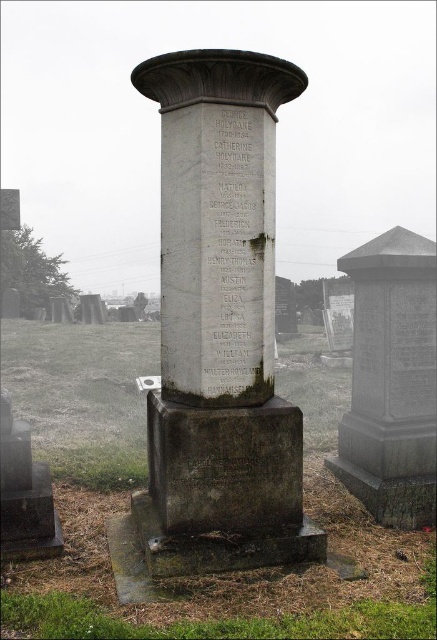
Between granite stone monument at center and white marble stone at center, which one is positioned higher?

Positioned higher is white marble stone at center.

Between granite stone monument at center and white marble stone at center, which one is positioned lower?

granite stone monument at center is lower down.

Between point (381, 285) and point (217, 365), which one is positioned in front?

Point (217, 365) is more forward.

At what (x,y) coordinates should I click in order to perform the action: click on granite stone monument at center. Please return your answer as a coordinate pair (x, y). Looking at the image, I should click on point(391,380).

Does granite stone column at center appear on the right side of black stone inscription at lower center?

No, granite stone column at center is not to the right of black stone inscription at lower center.

Between point (212, 244) and point (228, 449), which one is positioned behind?

Point (212, 244)

The image size is (437, 640). What do you see at coordinates (218, 310) in the screenshot?
I see `granite stone column at center` at bounding box center [218, 310].

You are a GUI agent. You are given a task and a screenshot of the screen. Output one action in this format:
    pyautogui.click(x=<x>, y=<y>)
    Task: Click on the granite stone column at center
    
    Given the screenshot: What is the action you would take?
    pyautogui.click(x=218, y=310)

Does granite stone column at center have a lesser width compared to granite stone monument at center?

No.

Does point (210, 570) lie in front of point (377, 465)?

That is True.

Which is behind, point (242, 120) or point (412, 316)?

Point (412, 316)

Where is `granite stone column at center`? This screenshot has width=437, height=640. granite stone column at center is located at coordinates (218, 310).